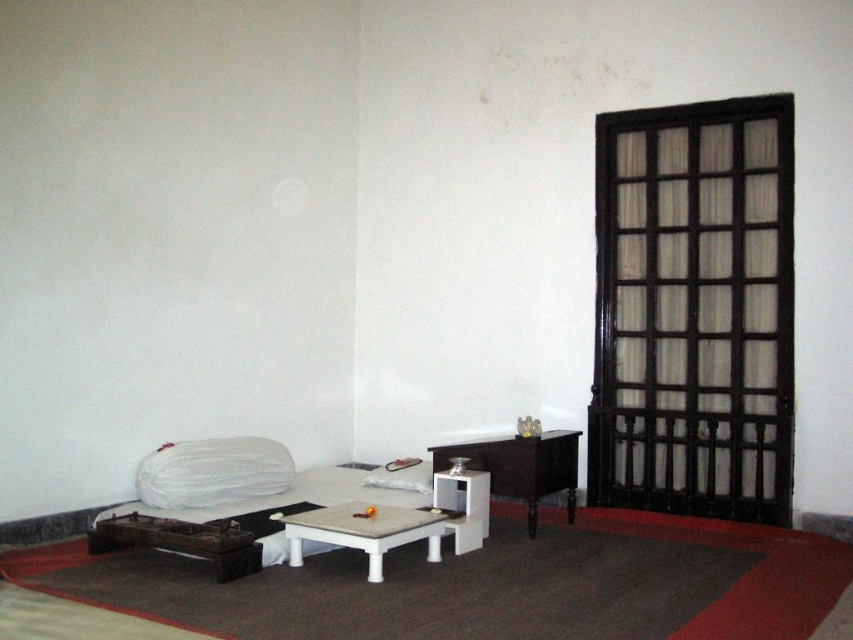
Looking at this image, who is higher up, white fabric pillow at lower center or white glossy table at center?

white fabric pillow at lower center is above.

Does white fabric pillow at lower center lie behind white glossy table at center?

Yes, white fabric pillow at lower center is behind white glossy table at center.

Who is more distant from viewer, (189, 493) or (390, 529)?

The point (189, 493) is behind.

Image resolution: width=853 pixels, height=640 pixels. I want to click on white fabric pillow at lower center, so click(x=213, y=472).

Between white fabric pillow at lower center and white matte pillow at center, which one appears on the left side from the viewer's perspective?

Positioned to the left is white fabric pillow at lower center.

Is white fabric pillow at lower center shorter than white matte pillow at center?

No.

The height and width of the screenshot is (640, 853). I want to click on white fabric pillow at lower center, so click(213, 472).

At what (x,y) coordinates should I click in order to perform the action: click on white fabric pillow at lower center. Please return your answer as a coordinate pair (x, y). This screenshot has width=853, height=640. Looking at the image, I should click on (213, 472).

Which is below, white fabric bed at lower left or white fabric pillow at lower center?

Positioned lower is white fabric bed at lower left.

Between point (196, 493) and point (258, 486), which one is positioned behind?

The point (258, 486) is more distant.

Which is in front, point (259, 452) or point (238, 500)?

Point (238, 500) is in front.

You are a GUI agent. You are given a task and a screenshot of the screen. Output one action in this format:
    pyautogui.click(x=<x>, y=<y>)
    Task: Click on the white fabric bed at lower left
    This screenshot has width=853, height=640.
    Given the screenshot: What is the action you would take?
    pyautogui.click(x=254, y=486)